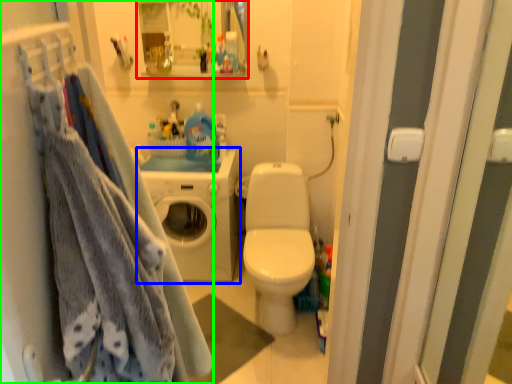
Question: Considering the real-world distances, which object is farthest from cabinet (highlighted by a red box)? washing machine (highlighted by a blue box) or closet (highlighted by a green box)?

Choices:
 (A) washing machine
 (B) closet

Answer: (B)